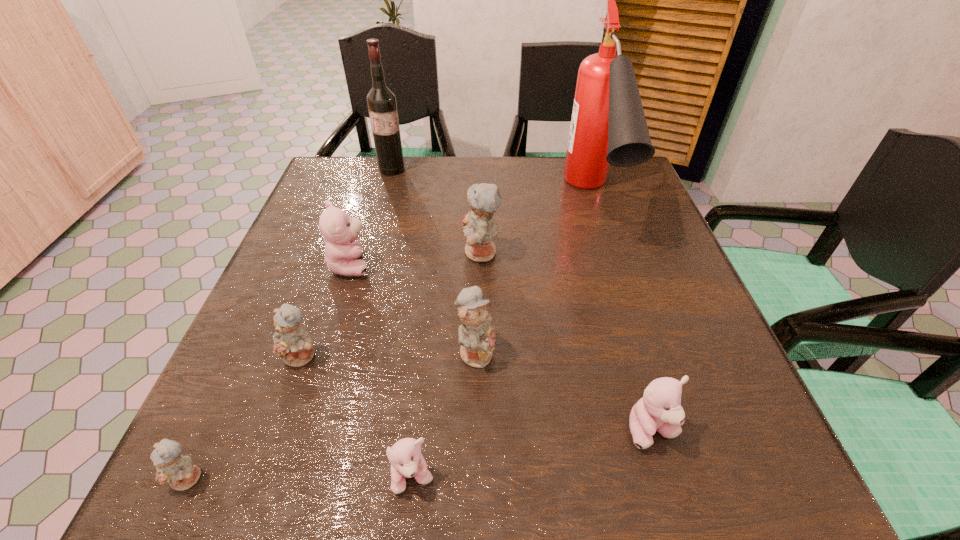
This screenshot has width=960, height=540. Identify the location of red fire extinguisher. (608, 126).

This screenshot has height=540, width=960. I want to click on fire extinguisher, so click(x=608, y=126).

Locate an element on the screen. This screenshot has width=960, height=540. wine bottle is located at coordinates (381, 101).

Identify the location of the tallest teddy bear. This screenshot has width=960, height=540. (480, 228).

You are a GUI agent. You are given a task and a screenshot of the screen. Output one action in this format:
    pyautogui.click(x=<x>, y=<y>)
    Task: Click on the biggest blue teddy bear
    The width and height of the screenshot is (960, 540).
    Given the screenshot: What is the action you would take?
    pyautogui.click(x=480, y=228)

What are the coordinates of `the leftmost pink teddy bear` in the screenshot? It's located at (342, 252).

What are the coordinates of `the farthest pink teddy bear` in the screenshot? It's located at (342, 252).

Locate an element on the screen. This screenshot has width=960, height=540. the third smallest blue teddy bear is located at coordinates point(475,335).

This screenshot has height=540, width=960. Identify the location of the third biggest blue teddy bear. (293, 344).

Image resolution: width=960 pixels, height=540 pixels. Identify the location of the fifth farthest teddy bear. (659, 409).